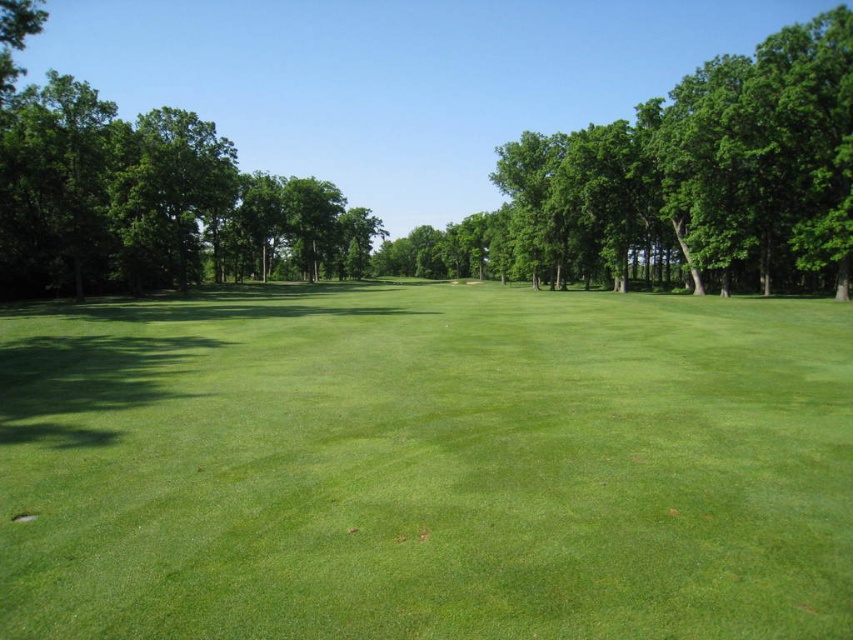
Can you confirm if green grassy field at center is positioned to the right of green smooth hole at lower left?

Indeed, green grassy field at center is positioned on the right side of green smooth hole at lower left.

Between green grassy field at center and green smooth hole at lower left, which one is positioned lower?

Positioned lower is green smooth hole at lower left.

Between point (482, 365) and point (12, 520), which one is positioned in front?

Point (12, 520) is in front.

The width and height of the screenshot is (853, 640). Find the location of `green grassy field at center`. green grassy field at center is located at coordinates (426, 467).

Does green grassy field at center appear under green leafy tree at center?

Yes, green grassy field at center is below green leafy tree at center.

Is green grassy field at center to the right of green leafy tree at center from the viewer's perspective?

No, green grassy field at center is not to the right of green leafy tree at center.

Who is more distant from viewer, (434, 342) or (137, 128)?

The point (137, 128) is more distant.

Where is `green grassy field at center`? The height and width of the screenshot is (640, 853). green grassy field at center is located at coordinates (426, 467).

Identify the location of green leafy tree at center. Image resolution: width=853 pixels, height=640 pixels. (463, 216).

Can you confirm if green leafy tree at center is taller than green smooth hole at lower left?

Yes, green leafy tree at center is taller than green smooth hole at lower left.

Find the location of a particular element. The height and width of the screenshot is (640, 853). green leafy tree at center is located at coordinates (463, 216).